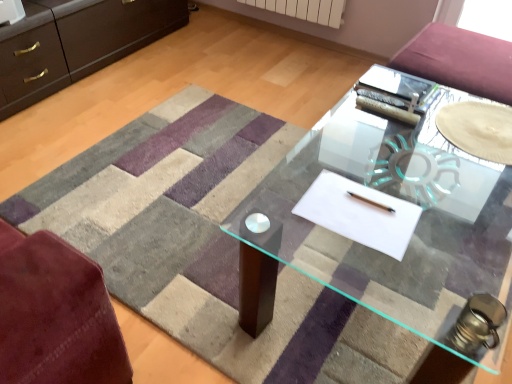
Question: From a real-world perspective, is white paper at center positioned above or below transparent glass table at center?

Choices:
 (A) above
 (B) below

Answer: (A)

Question: Do you think white paper at center is within transparent glass table at center, or outside of it?

Choices:
 (A) inside
 (B) outside

Answer: (B)

Question: Based on their relative distances, which object is farther from the transparent glass table at center?

Choices:
 (A) transparent glass plate at center
 (B) white paper at center

Answer: (B)

Question: Which is farther from the white paper at center?

Choices:
 (A) transparent glass plate at center
 (B) transparent glass table at center

Answer: (B)